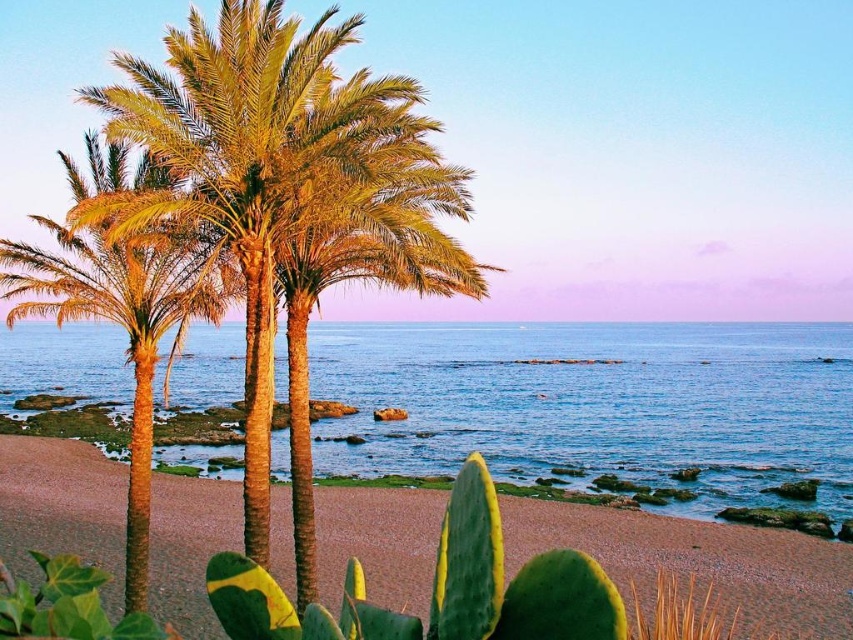
You are standing at the point marked by the coordinates point (598, 404) in the coastal scene. What is located at this point?

The point marked by the coordinates point (598, 404) is blue water at center.

You are standing at the origin point in the scene. The green leafy palm trees at center are at coordinates 0.264, 0.320. If you want to walk directly towards them, which direction should you head?

The green leafy palm trees at center are located at coordinates (271, 168), so you should head towards the center of the scene to reach them.

You are standing on the beach in the coastal scene. There are two points marked on the sand. One is at coordinate point (x=178, y=365) and the other is at point (x=252, y=264). Which point is closer to you as you face the ocean?

Point (x=178, y=365) is closer to you because it is further to the viewer than point (x=252, y=264).